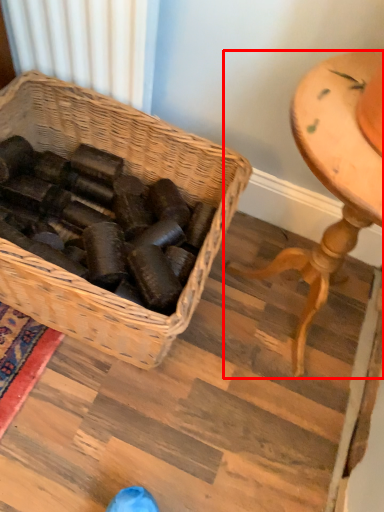
Question: From the image's perspective, considering the relative positions of furniture (annotated by the red box) and picnic basket in the image provided, where is furniture (annotated by the red box) located with respect to the staircase?

Choices:
 (A) above
 (B) below

Answer: (B)